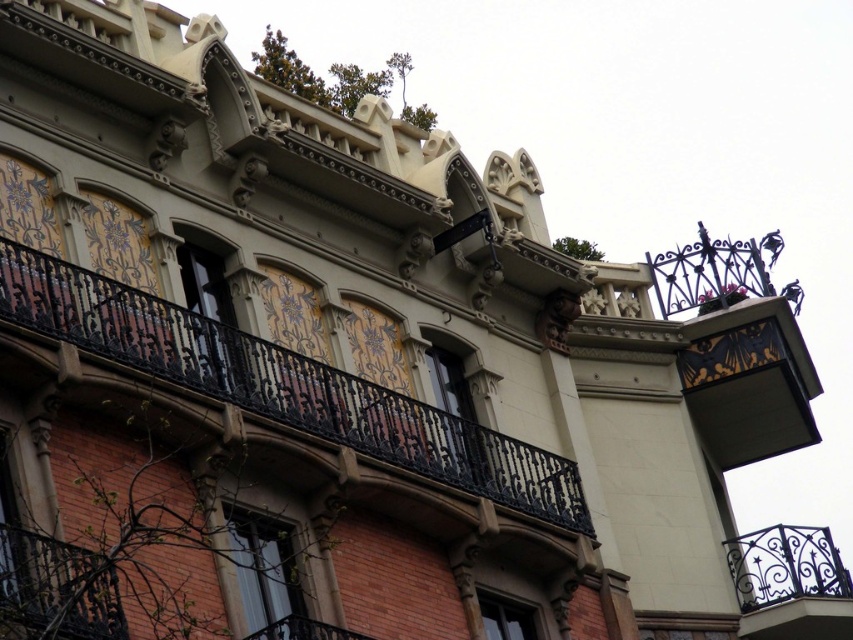
Is black wrought iron balcony at center in front of black wrought iron balcony at lower left?

No.

Which is in front, point (15, 243) or point (102, 573)?

Positioned in front is point (102, 573).

The width and height of the screenshot is (853, 640). What do you see at coordinates (283, 385) in the screenshot? I see `black wrought iron balcony at center` at bounding box center [283, 385].

Find the location of a particular element. Image resolution: width=853 pixels, height=640 pixels. black wrought iron balcony at center is located at coordinates (283, 385).

Measure the distance between black wrought iron balcony at center and wrought iron balcony at upper right.

A distance of 18.68 meters exists between black wrought iron balcony at center and wrought iron balcony at upper right.

Which is behind, point (59, 262) or point (786, 592)?

The point (786, 592) is more distant.

This screenshot has height=640, width=853. Find the location of `black wrought iron balcony at center`. black wrought iron balcony at center is located at coordinates (283, 385).

Is wrought iron balcony at upper right further to camera compared to black wrought iron balcony at lower left?

Yes, wrought iron balcony at upper right is further from the viewer.

Which is more to the right, wrought iron balcony at upper right or black wrought iron balcony at lower left?

wrought iron balcony at upper right is more to the right.

Who is more forward, (798, 604) or (33, 602)?

Point (33, 602) is more forward.

You are a GUI agent. You are given a task and a screenshot of the screen. Output one action in this format:
    pyautogui.click(x=<x>, y=<y>)
    Task: Click on the wrought iron balcony at upper right
    The image size is (853, 640).
    Given the screenshot: What is the action you would take?
    pyautogui.click(x=790, y=582)